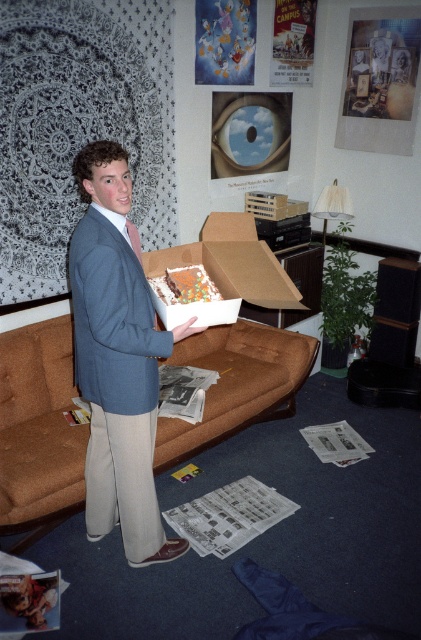
Question: Estimate the real-world distances between objects in this image. Which object is closer to the chocolate frosted cake at center?

Choices:
 (A) brown fabric couch at center
 (B) white cardboard box at center
 (C) matte blue blazer at center
 (D) pink satin tie at left

Answer: (B)

Question: Where is brown fabric couch at center located in relation to chocolate frosted cake at center in the image?

Choices:
 (A) below
 (B) above

Answer: (A)

Question: Does chocolate frosted cake at center have a lesser width compared to pink satin tie at left?

Choices:
 (A) no
 (B) yes

Answer: (A)

Question: Among these objects, which one is farthest from the camera?

Choices:
 (A) pink satin tie at left
 (B) white cardboard box at center
 (C) matte blue blazer at center

Answer: (B)

Question: In this image, where is brown fabric couch at center located relative to pink satin tie at left?

Choices:
 (A) below
 (B) above

Answer: (A)

Question: Which object appears closest to the camera in this image?

Choices:
 (A) white cardboard box at center
 (B) pink satin tie at left

Answer: (B)